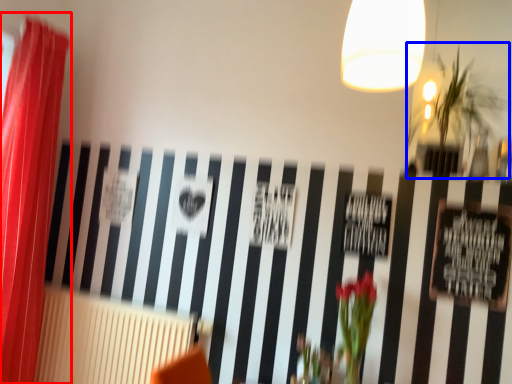
Question: Which object is closer to the camera taking this photo, curtain (highlighted by a red box) or plant (highlighted by a blue box)?

Choices:
 (A) curtain
 (B) plant

Answer: (B)